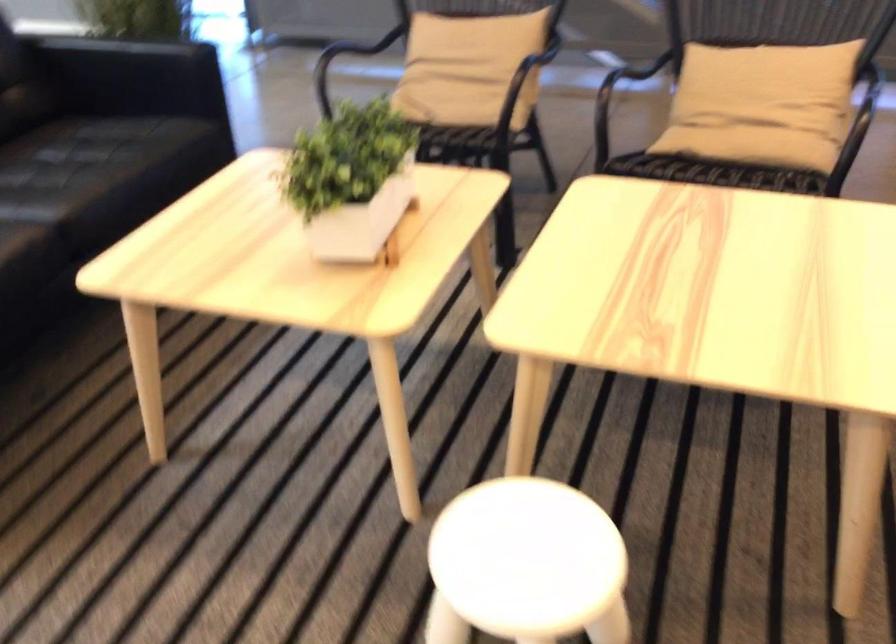
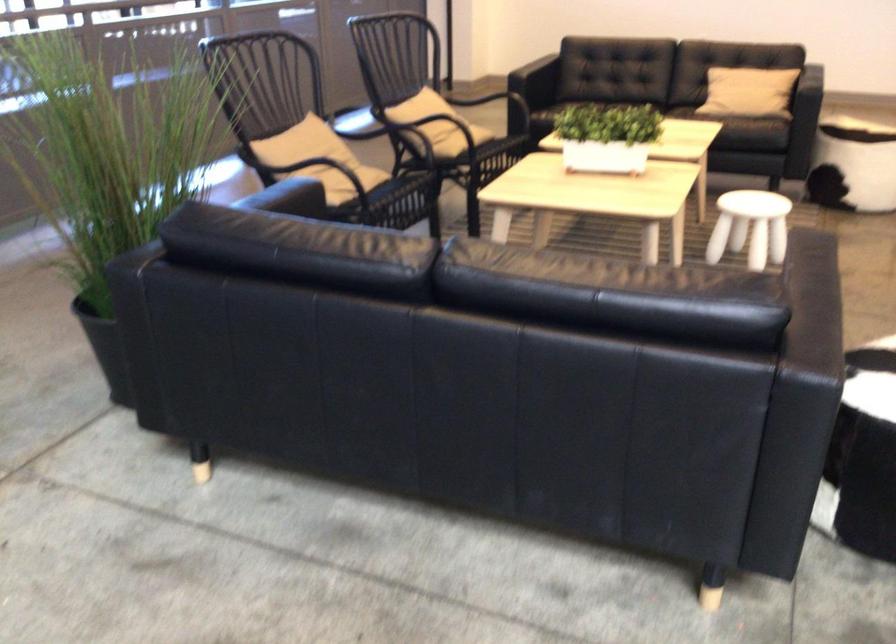
Question: I am providing you with two images of the same scene from different viewpoints. Which of the following objects are not visible in image2?

Choices:
 (A) black chair armrest
 (B) beige throw pillow
 (C) patterned cylindrical ottoman
 (D) none of these

Answer: (D)